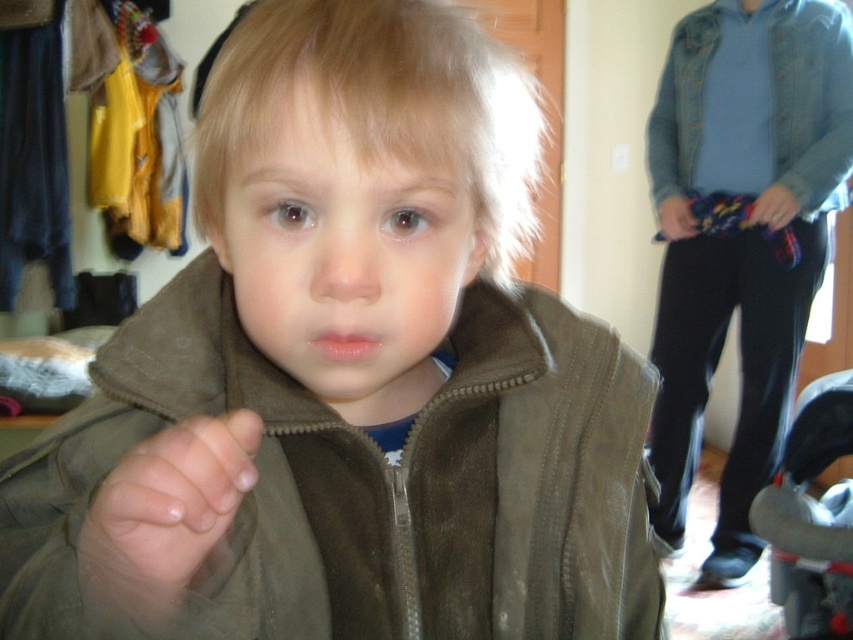
Is smooth skin hand at center below black plastic baby carriage at lower right?

Actually, smooth skin hand at center is above black plastic baby carriage at lower right.

Does point (108, 566) come behind point (808, 632)?

No.

You are a GUI agent. You are given a task and a screenshot of the screen. Output one action in this format:
    pyautogui.click(x=<x>, y=<y>)
    Task: Click on the smooth skin hand at center
    The width and height of the screenshot is (853, 640).
    Given the screenshot: What is the action you would take?
    pyautogui.click(x=170, y=502)

Can you confirm if brown suede jacket at upper right is smaller than black plastic baby carriage at lower right?

No.

Where is `brown suede jacket at upper right`? Image resolution: width=853 pixels, height=640 pixels. brown suede jacket at upper right is located at coordinates (741, 236).

Does point (769, 58) come closer to viewer compared to point (808, 445)?

That is False.

The height and width of the screenshot is (640, 853). Identify the location of brown suede jacket at upper right. (741, 236).

At what (x,y) coordinates should I click in order to perform the action: click on brown suede jacket at upper right. Please return your answer as a coordinate pair (x, y). The image size is (853, 640). Looking at the image, I should click on (741, 236).

Is brown suede jacket at upper right further to camera compared to smooth skin hand at center?

Yes.

Between point (738, 260) and point (125, 460), which one is positioned in front?

Point (125, 460) is in front.

Identify the location of brown suede jacket at upper right. (741, 236).